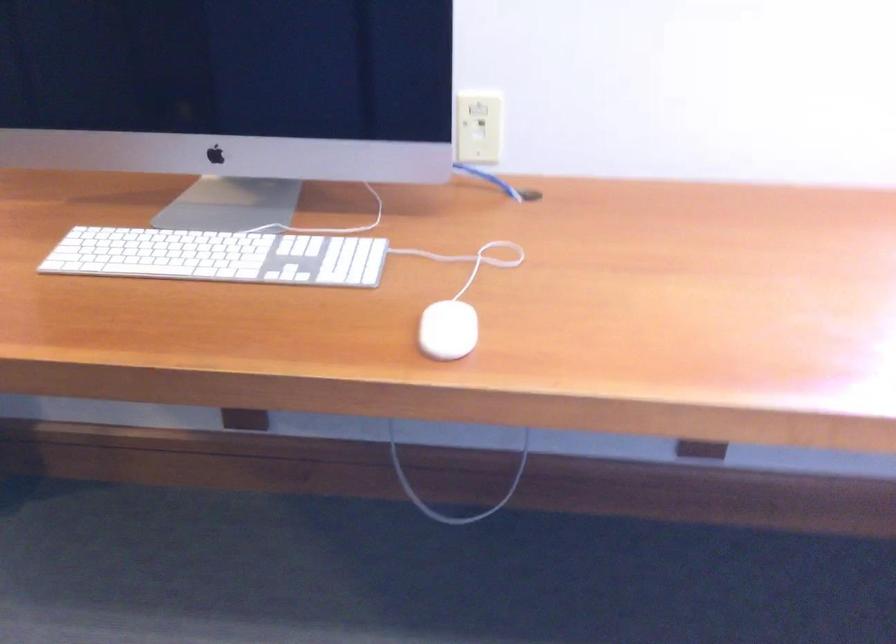
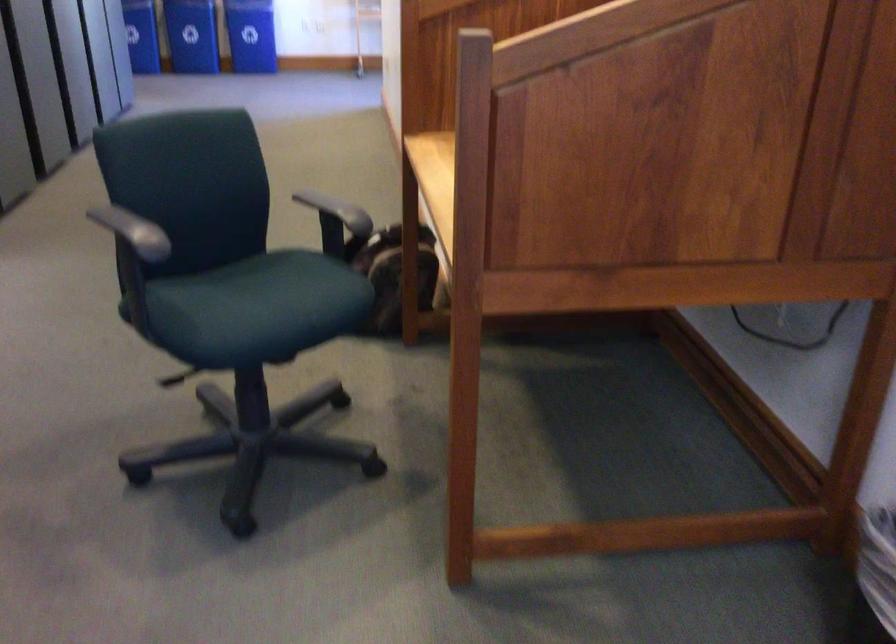
Question: The camera is either moving clockwise (left) or counter-clockwise (right) around the object. The first image is from the beginning of the video and the second image is from the end. Is the camera moving left or right when shooting the video?

Choices:
 (A) Left
 (B) Right

Answer: (B)